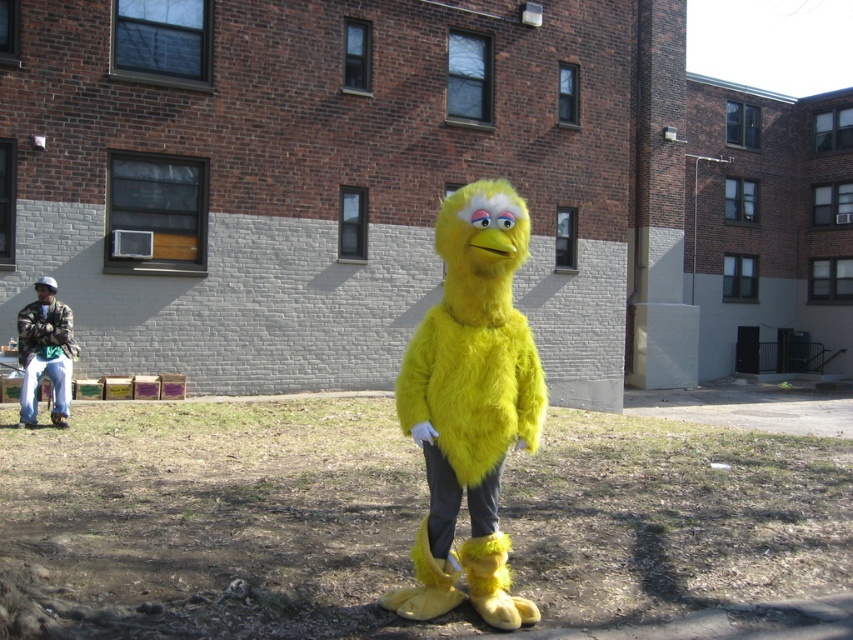
Which is more to the right, fluffy yellow bird at center or camo fabric jacket at left?

fluffy yellow bird at center is more to the right.

Does fluffy yellow bird at center appear on the right side of camo fabric jacket at left?

Correct, you'll find fluffy yellow bird at center to the right of camo fabric jacket at left.

Describe the element at coordinates (469, 404) in the screenshot. This screenshot has width=853, height=640. I see `fluffy yellow bird at center` at that location.

I want to click on fluffy yellow bird at center, so click(x=469, y=404).